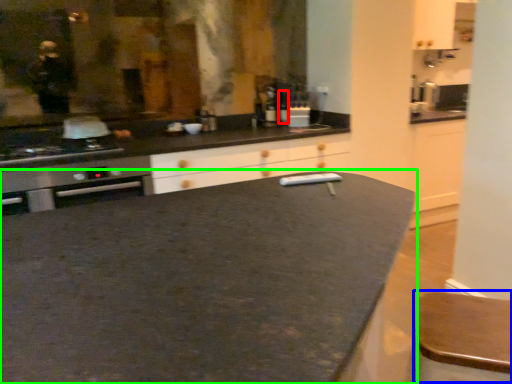
Question: Which is farther away from bottle (highlighted by a red box)? bar stool (highlighted by a blue box) or countertop (highlighted by a green box)?

Choices:
 (A) bar stool
 (B) countertop

Answer: (A)